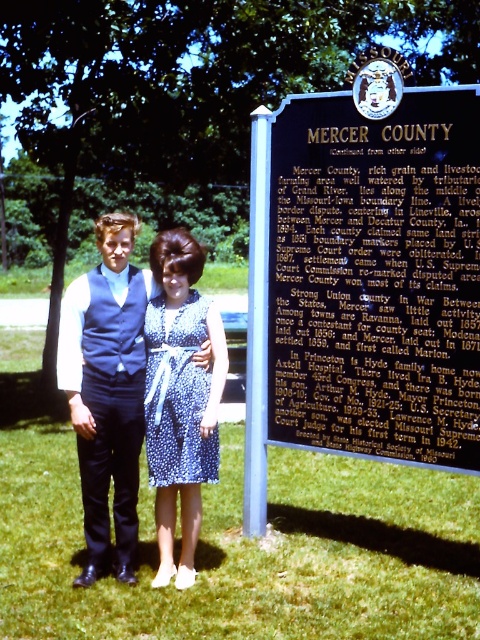
Can you confirm if black metal sign at upper center is taller than blue dotted fabric dress at center?

Yes, black metal sign at upper center is taller than blue dotted fabric dress at center.

Between black metal sign at upper center and blue dotted fabric dress at center, which one has more height?

black metal sign at upper center

I want to click on black metal sign at upper center, so click(x=375, y=278).

Who is shorter, blue dotted dress at center or blue dotted fabric dress at center?

blue dotted fabric dress at center

Based on the photo, who is taller, blue dotted dress at center or blue dotted fabric dress at center?

With more height is blue dotted dress at center.

At what (x,y) coordinates should I click in order to perform the action: click on blue dotted dress at center. Please return your answer as a coordinate pair (x, y). Image resolution: width=480 pixels, height=640 pixels. Looking at the image, I should click on (180, 397).

Which is more to the left, black metal sign at upper center or matte blue dress at center?

matte blue dress at center

Consider the image. Can you confirm if black metal sign at upper center is wider than matte blue dress at center?

Correct, the width of black metal sign at upper center exceeds that of matte blue dress at center.

Locate an element on the screen. The height and width of the screenshot is (640, 480). black metal sign at upper center is located at coordinates point(375,278).

At what (x,y) coordinates should I click in order to perform the action: click on black metal sign at upper center. Please return your answer as a coordinate pair (x, y). Looking at the image, I should click on (375, 278).